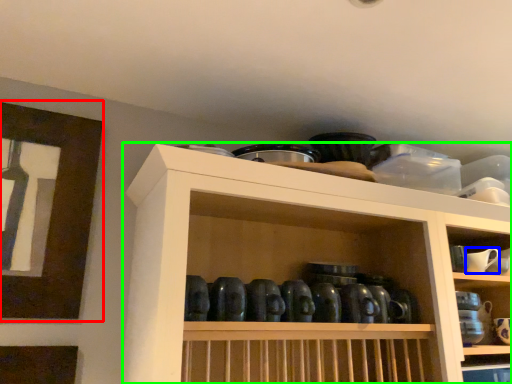
Question: Which object is positioned farthest from picture frame (highlighted by a red box)? Select from tableware (highlighted by a blue box) and shelf (highlighted by a green box).

Choices:
 (A) tableware
 (B) shelf

Answer: (A)